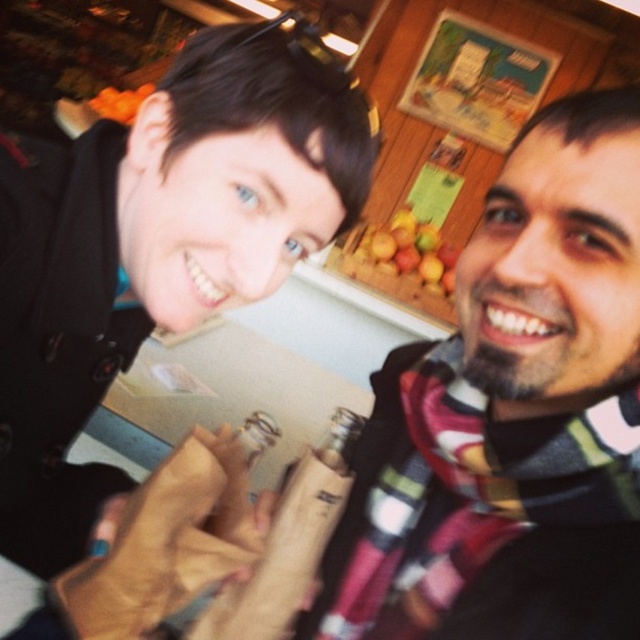
Who is shorter, flannel scarf at right or plaid wool scarf at right?

plaid wool scarf at right

Measure the distance between flannel scarf at right and camera.

flannel scarf at right is 21.99 inches from camera.

Locate an element on the screen. The width and height of the screenshot is (640, 640). flannel scarf at right is located at coordinates (157, 244).

Does flannel scarf at right appear on the left side of smooth wooden board at upper center?

Correct, you'll find flannel scarf at right to the left of smooth wooden board at upper center.

Who is higher up, flannel scarf at right or smooth wooden board at upper center?

smooth wooden board at upper center is above.

Where is `flannel scarf at right`? The image size is (640, 640). flannel scarf at right is located at coordinates (157, 244).

Can you confirm if plaid wool scarf at right is positioned below smooth wooden board at upper center?

Yes, plaid wool scarf at right is below smooth wooden board at upper center.

How much distance is there between plaid wool scarf at right and smooth wooden board at upper center?

They are 1.61 meters apart.

Find the location of a particular element. The image size is (640, 640). plaid wool scarf at right is located at coordinates (483, 515).